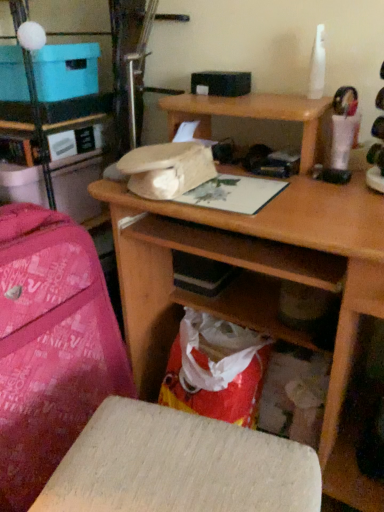
Where is `wooden stool at lower center`? wooden stool at lower center is located at coordinates (179, 466).

Image resolution: width=384 pixels, height=512 pixels. Describe the element at coordinates (66, 71) in the screenshot. I see `blue cardboard box at upper left` at that location.

Describe the element at coordinates (50, 346) in the screenshot. I see `pink fabric suitcase at left` at that location.

At what (x,y) coordinates should I click in order to perform the action: click on pink fabric suitcase at left. Please return your answer as a coordinate pair (x, y). Looking at the image, I should click on (50, 346).

Describe the element at coordinates (258, 287) in the screenshot. This screenshot has width=384, height=512. I see `wooden desk at center` at that location.

What do you see at coordinates (19, 136) in the screenshot?
I see `pink fabric bag at left` at bounding box center [19, 136].

Find the location of `wooden stool at lower center`. wooden stool at lower center is located at coordinates (179, 466).

Is pink fabric bag at left next to wooden stool at lower center and touching it?

No.

Does pink fabric bag at left have a greater height compared to wooden stool at lower center?

In fact, pink fabric bag at left may be shorter than wooden stool at lower center.

Does pink fabric bag at left turn towards wooden stool at lower center?

No, pink fabric bag at left is not facing towards wooden stool at lower center.

Is wooden desk at center with blue cardboard box at upper left?

wooden desk at center and blue cardboard box at upper left are clearly separated.

Would you say wooden desk at center is outside blue cardboard box at upper left?

Yes, wooden desk at center is outside of blue cardboard box at upper left.

Who is taller, wooden desk at center or blue cardboard box at upper left?

wooden desk at center is taller.

Find the location of a particular element. The width and height of the screenshot is (384, 512). cardboard box above the wooden desk at center (from the image's perspective) is located at coordinates (66, 71).

What's the angular difference between wooden stool at lower center and blue cardboard box at upper left's facing directions?

The angular difference between wooden stool at lower center and blue cardboard box at upper left is 1.53 degrees.

The height and width of the screenshot is (512, 384). I want to click on cardboard box on the left side of wooden stool at lower center, so click(x=66, y=71).

Which point is more forward, (x=290, y=450) or (x=22, y=96)?

Positioned in front is point (x=290, y=450).

Is wooden stool at lower center taller or shorter than blue cardboard box at upper left?

Considering their sizes, wooden stool at lower center has more height than blue cardboard box at upper left.

Is pink fabric suitcase at left a part of wooden desk at center?

No.

The width and height of the screenshot is (384, 512). In order to click on desk located on the right of pink fabric suitcase at left in this screenshot , I will do `click(258, 287)`.

From the image's perspective, who appears lower, wooden desk at center or pink fabric suitcase at left?

pink fabric suitcase at left is shown below in the image.

Considering the sizes of objects wooden desk at center and pink fabric suitcase at left in the image provided, who is taller, wooden desk at center or pink fabric suitcase at left?

wooden desk at center.

Is blue cardboard box at upper left thinner than pink fabric bag at left?

Yes, blue cardboard box at upper left is thinner than pink fabric bag at left.

Based on the photo, is the position of blue cardboard box at upper left more distant than that of pink fabric bag at left?

No, it is in front of pink fabric bag at left.

Can you confirm if blue cardboard box at upper left is positioned to the right of pink fabric bag at left?

Yes, blue cardboard box at upper left is to the right of pink fabric bag at left.

Is blue cardboard box at upper left not near pink fabric bag at left?

No, blue cardboard box at upper left is in close proximity to pink fabric bag at left.

Would you say pink fabric suitcase at left is inside or outside pink fabric bag at left?

pink fabric suitcase at left is outside pink fabric bag at left.

In terms of size, does pink fabric suitcase at left appear bigger or smaller than pink fabric bag at left?

pink fabric suitcase at left is bigger than pink fabric bag at left.

Looking at this image, is pink fabric suitcase at left far from pink fabric bag at left?

No, pink fabric suitcase at left is not far away from pink fabric bag at left.

From the image's perspective, is pink fabric suitcase at left below pink fabric bag at left?

Yes.

Image resolution: width=384 pixels, height=512 pixels. What are the coordinates of `desk beneath the pink fabric bag at left (from a real-world perspective)` in the screenshot? It's located at (258, 287).

Between point (290, 266) and point (74, 127), which one is positioned behind?

The point (74, 127) is behind.

Is wooden desk at center placed right next to pink fabric bag at left?

No, wooden desk at center is not beside pink fabric bag at left.

How different are the orientations of wooden desk at center and pink fabric bag at left in degrees?

0.535 degrees separate the facing orientations of wooden desk at center and pink fabric bag at left.

Where is `shelf that is above the wooden stool at lower center (from a real-world perspective)`? The height and width of the screenshot is (512, 384). shelf that is above the wooden stool at lower center (from a real-world perspective) is located at coordinates (19, 136).

You are a GUI agent. You are given a task and a screenshot of the screen. Output one action in this format:
    pyautogui.click(x=<x>, y=<y>)
    Task: Click on the desk on the right of the blue cardboard box at upper left
    This screenshot has height=512, width=384.
    Given the screenshot: What is the action you would take?
    pyautogui.click(x=258, y=287)

Based on the photo, which object lies nearer to the anchor point pink fabric bag at left, pink fabric suitcase at left or blue cardboard box at upper left?

blue cardboard box at upper left lies closer to pink fabric bag at left than the other object.

Which object lies further to the anchor point pink fabric bag at left, wooden desk at center or blue cardboard box at upper left?

Among the two, wooden desk at center is located further to pink fabric bag at left.

Considering their positions, is pink fabric suitcase at left positioned closer to blue cardboard box at upper left than wooden stool at lower center?

pink fabric suitcase at left is positioned closer to the anchor blue cardboard box at upper left.

Estimate the real-world distances between objects in this image. Which object is further from blue cardboard box at upper left, pink fabric bag at left or pink fabric suitcase at left?

pink fabric suitcase at left is positioned further to the anchor blue cardboard box at upper left.

Estimate the real-world distances between objects in this image. Which object is further from pink fabric suitcase at left, wooden desk at center or blue cardboard box at upper left?

blue cardboard box at upper left.

From the image, which object appears to be nearer to blue cardboard box at upper left, pink fabric bag at left or wooden desk at center?

pink fabric bag at left is positioned closer to the anchor blue cardboard box at upper left.

Considering their positions, is wooden stool at lower center positioned closer to blue cardboard box at upper left than pink fabric bag at left?

pink fabric bag at left is closer to blue cardboard box at upper left.

Considering their positions, is wooden stool at lower center positioned further to pink fabric suitcase at left than pink fabric bag at left?

pink fabric bag at left is positioned further to the anchor pink fabric suitcase at left.

Where is `shelf between blue cardboard box at upper left and wooden stool at lower center in the vertical direction`? The width and height of the screenshot is (384, 512). shelf between blue cardboard box at upper left and wooden stool at lower center in the vertical direction is located at coordinates (19, 136).

Find the location of a particular element. luggage that lies between pink fabric bag at left and wooden stool at lower center from top to bottom is located at coordinates (50, 346).

Where is `furniture between pink fabric suitcase at left and wooden desk at center from left to right`? furniture between pink fabric suitcase at left and wooden desk at center from left to right is located at coordinates (179, 466).

This screenshot has width=384, height=512. What are the coordinates of `desk between pink fabric bag at left and wooden stool at lower center in the vertical direction` in the screenshot? It's located at (258, 287).